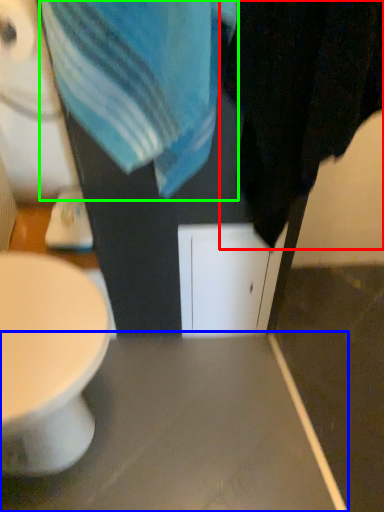
Question: Which is farther away from bath towel (highlighted by a red box)? table (highlighted by a blue box) or beach towel (highlighted by a green box)?

Choices:
 (A) table
 (B) beach towel

Answer: (A)